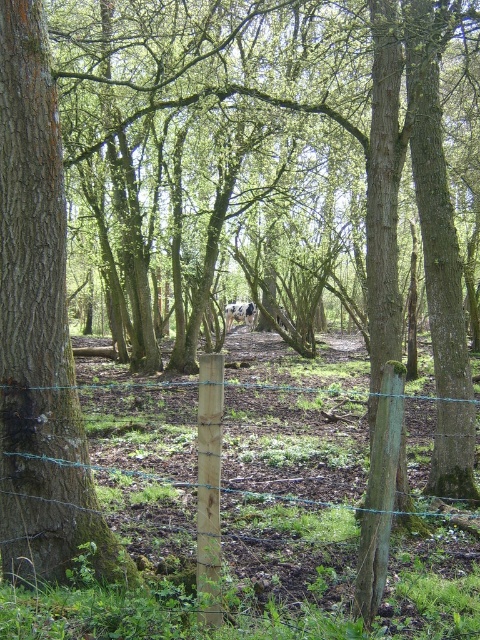
Question: Which point is closer to the camera taking this photo?

Choices:
 (A) (442, 596)
 (B) (58, 124)

Answer: (B)

Question: Which of the following is the farthest from the observer?

Choices:
 (A) rough bark tree at center
 (B) green wire fence at center

Answer: (A)

Question: Which point is farther to the camera?

Choices:
 (A) green wire fence at center
 (B) rough bark tree at center

Answer: (B)

Question: Considering the relative positions of green wire fence at center and rough bark tree at center in the image provided, where is green wire fence at center located with respect to rough bark tree at center?

Choices:
 (A) left
 (B) right

Answer: (B)

Question: Considering the relative positions of green wire fence at center and rough bark tree at center in the image provided, where is green wire fence at center located with respect to rough bark tree at center?

Choices:
 (A) below
 (B) above

Answer: (A)

Question: Is green wire fence at center positioned behind rough bark tree at center?

Choices:
 (A) yes
 (B) no

Answer: (B)